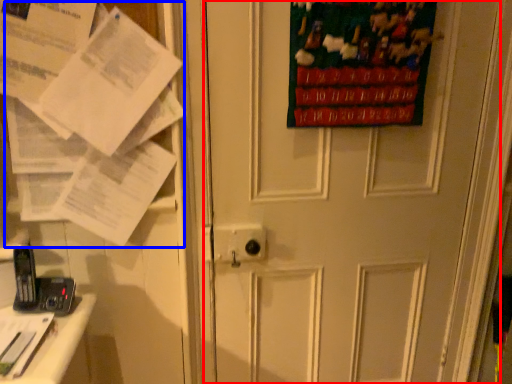
Question: Which point is further to the camera, door (highlighted by a red box) or paper (highlighted by a blue box)?

Choices:
 (A) door
 (B) paper

Answer: (A)